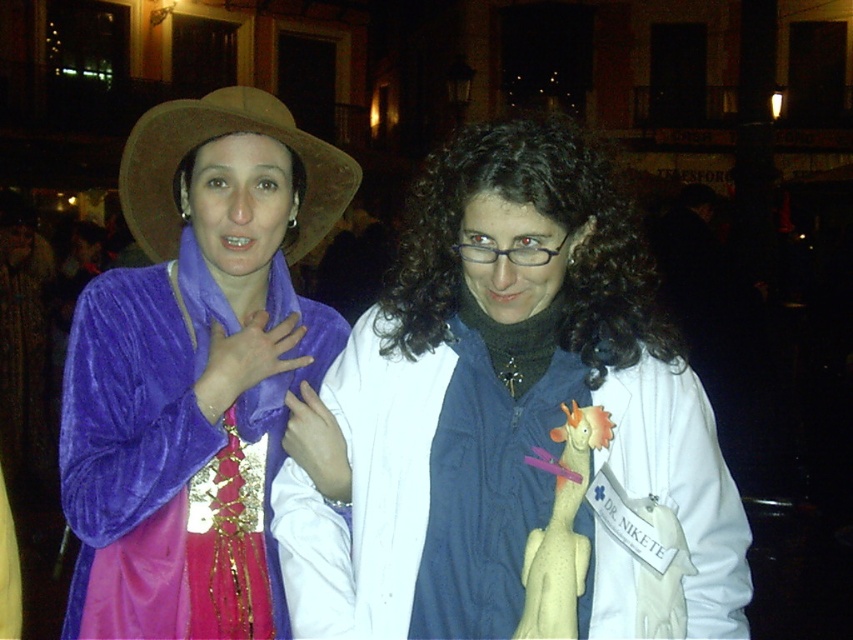
Is point (225, 104) positioned in front of point (166, 157)?

That is True.

Which of these two, velvet purple dress at left or brown felt cowboy hat at upper left, stands shorter?

brown felt cowboy hat at upper left is shorter.

Locate an element on the screen. This screenshot has height=640, width=853. velvet purple dress at left is located at coordinates (195, 371).

Can you confirm if white matte coat at center is thinner than velvet purple dress at left?

No.

The image size is (853, 640). What do you see at coordinates (514, 422) in the screenshot?
I see `white matte coat at center` at bounding box center [514, 422].

Where is `white matte coat at center`? The width and height of the screenshot is (853, 640). white matte coat at center is located at coordinates (514, 422).

Is point (648, 612) farther from camera compared to point (320, 230)?

No.

Is the position of white matte coat at center less distant than that of brown felt cowboy hat at upper left?

Yes, white matte coat at center is closer to the viewer.

The width and height of the screenshot is (853, 640). I want to click on white matte coat at center, so click(x=514, y=422).